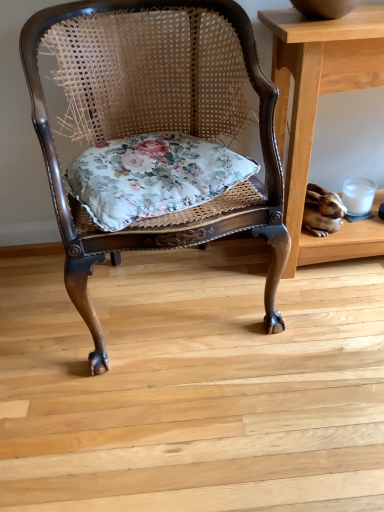
The height and width of the screenshot is (512, 384). What are the coordinates of `vacant area that is in front of light brown wooden table at right` in the screenshot? It's located at (327, 329).